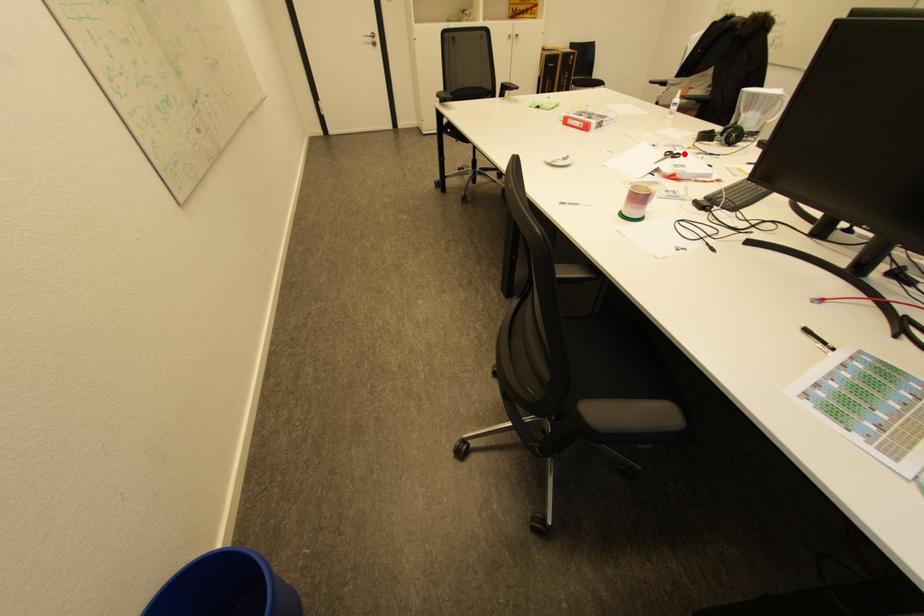
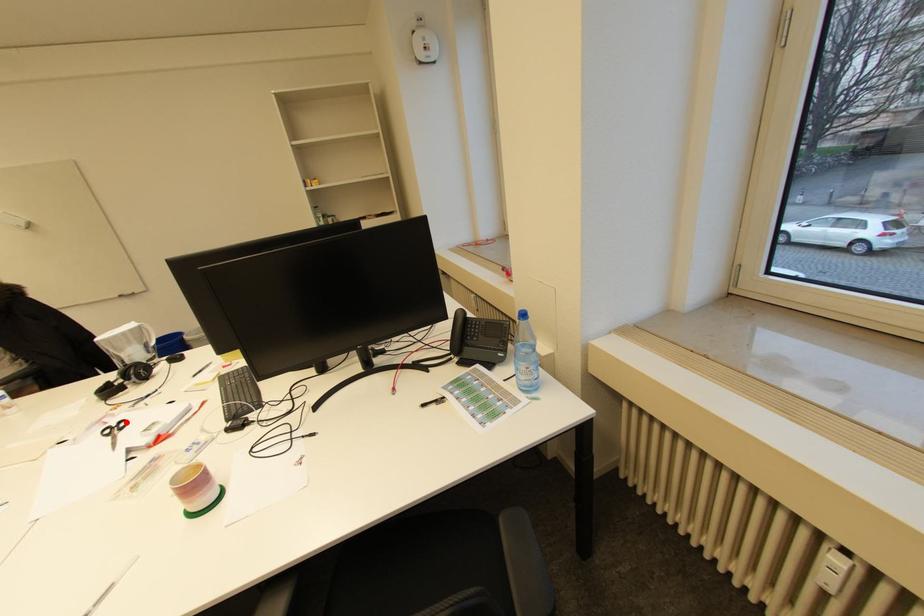
I am providing you with two images of the same scene from different viewpoints. A red point is marked on the first image and another point is marked on the second image. Does the point marked in image1 correspond to the same location as the one in image2?

Yes